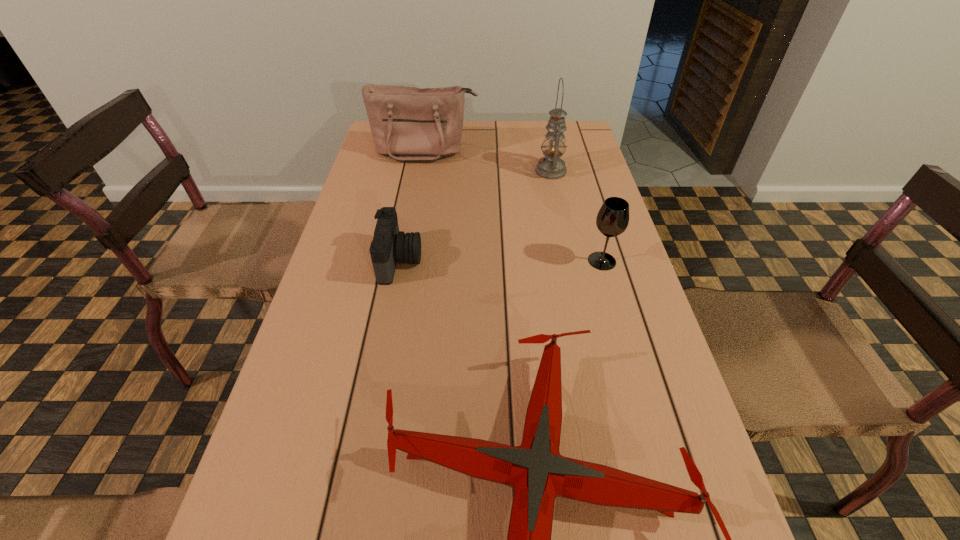
The image size is (960, 540). What are the coordinates of `vacant space that satisfies the following two spatial constraints: 1. on the front pocket of the second tallest object; 2. at the lens of the camera` in the screenshot? It's located at (407, 261).